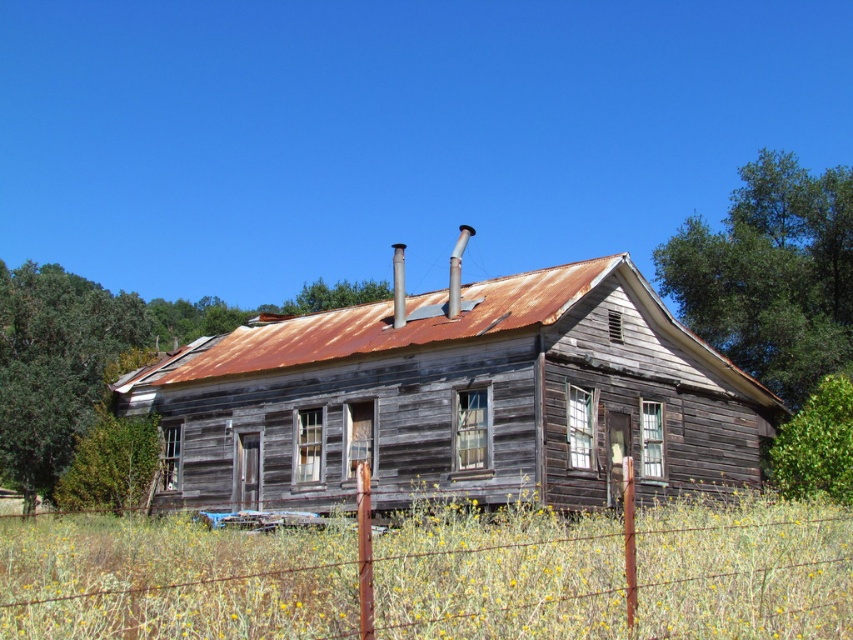
Between point (88, 310) and point (389, 296), which one is positioned behind?

The point (389, 296) is more distant.

Who is more forward, (51, 488) or (387, 292)?

Point (51, 488) is more forward.

This screenshot has height=640, width=853. I want to click on green leafy tree at left, so click(54, 365).

Who is positioned more to the left, weathered wood tree at center or green leafy tree at upper center?

weathered wood tree at center is more to the left.

Based on the photo, does weathered wood tree at center have a greater width compared to green leafy tree at upper center?

Yes.

Which is behind, point (82, 282) or point (329, 300)?

Point (82, 282)

Locate an element on the screen. weathered wood tree at center is located at coordinates (79, 378).

Does green leafy tree at upper right come behind green leafy tree at left?

That is True.

Describe the element at coordinates (770, 275) in the screenshot. I see `green leafy tree at upper right` at that location.

Identify the location of green leafy tree at upper right. (770, 275).

This screenshot has width=853, height=640. I want to click on green leafy tree at upper right, so click(x=770, y=275).